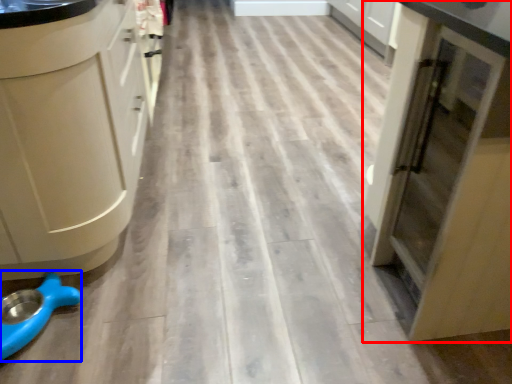
Question: Which of the following is the farthest to the observer, cupboard (highlighted by a red box) or appliance (highlighted by a blue box)?

Choices:
 (A) cupboard
 (B) appliance

Answer: (B)